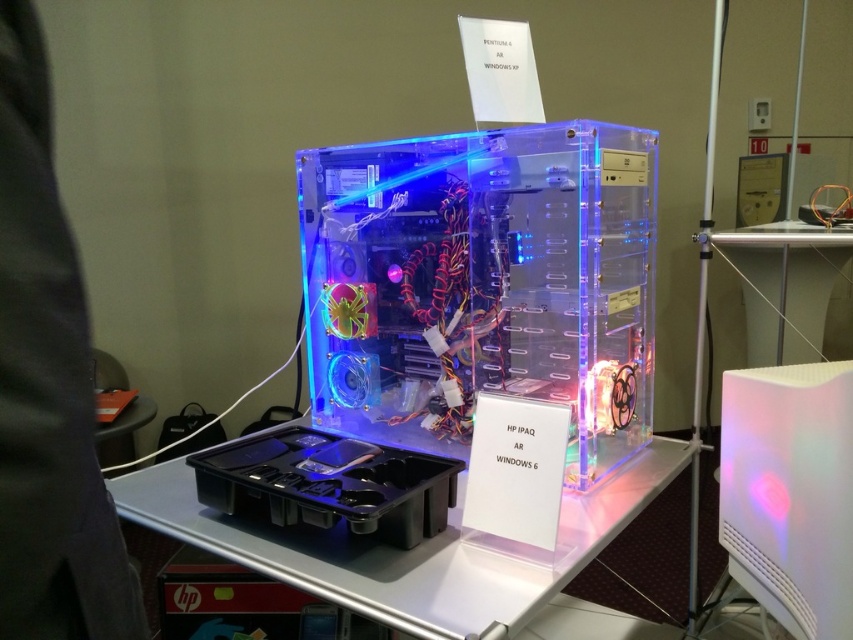
You are a photographer at the tech exhibition and want to capture a closeup of the HP IPAQ AR WINDOWS 6 sign attached to the computer case. You have a camera with a fixed focus set at the position of point 1. Which point between point 1 at point (610, 496) and point 2 at point (292, 484) should you focus on to ensure the HP IPAQ AR WINDOWS 6 sign is in focus?

You should focus on point 1 at point (610, 496) because it is further to the camera than point 2 at point (292, 484), meaning the HP IPAQ AR WINDOWS 6 sign is closer to the camera and within the focus range of point 1.

What is the object located at the coordinates point (x=329, y=483) in the transparent computer case?

The point (x=329, y=483) indicates the translucent plastic tray at center.